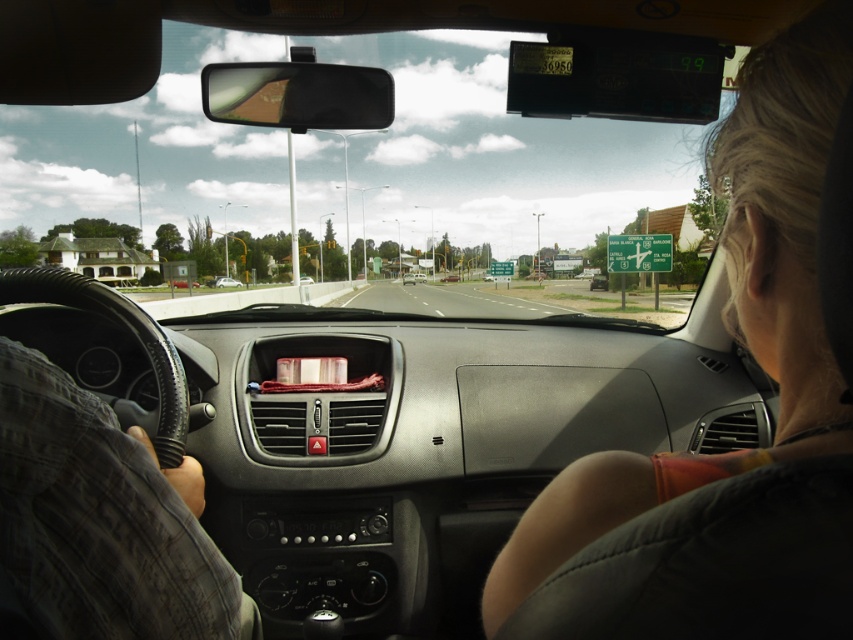
Question: Which point is closer to the camera?

Choices:
 (A) (88, 198)
 (B) (776, 440)

Answer: (B)

Question: Which object is positioned closest to the metallic silver sedan at center?

Choices:
 (A) blonde hair at upper right
 (B) transparent glass windshield at center

Answer: (B)

Question: Can you confirm if blonde hair at upper right is positioned below metallic silver sedan at center?

Choices:
 (A) yes
 (B) no

Answer: (A)

Question: Does transparent glass windshield at center lie in front of metallic silver sedan at center?

Choices:
 (A) yes
 (B) no

Answer: (A)

Question: Can you confirm if transparent glass windshield at center is smaller than blonde hair at upper right?

Choices:
 (A) yes
 (B) no

Answer: (B)

Question: Which point is farther to the camera?

Choices:
 (A) metallic silver sedan at center
 (B) transparent glass windshield at center

Answer: (A)